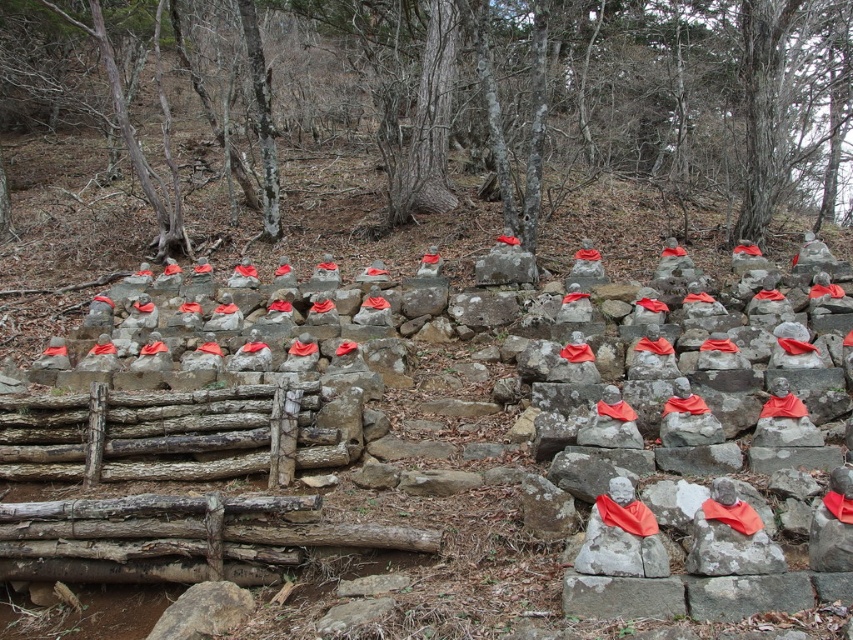
You are standing in the outdoor area with the stone statues. You notice two points marked as point coordinates in the scene. Which point is closer to you, point (225, 298) or point (737, 556)?

Point (225, 298) is closer to you than point (737, 556) because it is further to the viewer, meaning it is physically nearer in the three dimensional space of the scene.

You are a hiker who just arrived at this outdoor area. You notice two items at the center of the scene. One is weathered wood at center and the other is smooth gray rock at center. Which one is taller?

The weathered wood at center is much taller than the smooth gray rock at center.